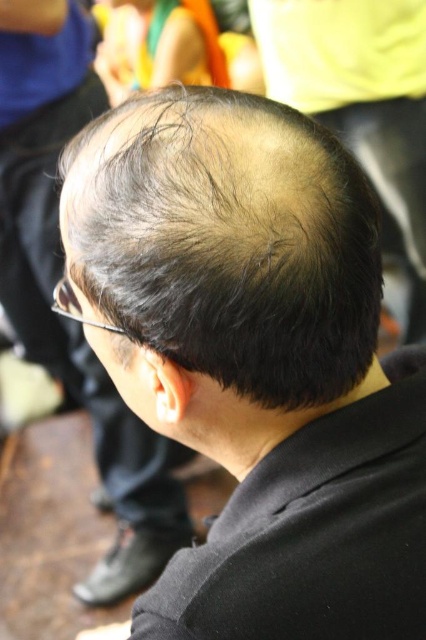
You are a hair stylist analyzing a client photo. The client has dark brown hair at center and dark brown hair at upper center. Which area shows more visible thinning?

The dark brown hair at center is thinner than dark brown hair at upper center, so the area with more visible thinning is the dark brown hair at center.

You are a photographer adjusting your camera settings. You want to focus on the dark brown hair at center. What coordinates should you set your camera to ensure proper focus?

To focus on the dark brown hair at center, set the camera coordinates to point 0.378 on the x axis and 0.535 on the y axis, as specified by the position provided.

You are holding a small drone that can fly up to 50 centimeters away from you. You want to fly it to the point marked at coordinates point (313, 177) in the image. Will the drone be able to reach that point without exceeding its maximum distance?

The distance of point (313, 177) from viewer is 49.38 centimeters, so the drone can reach it since it is within the 50 centimeter limit.